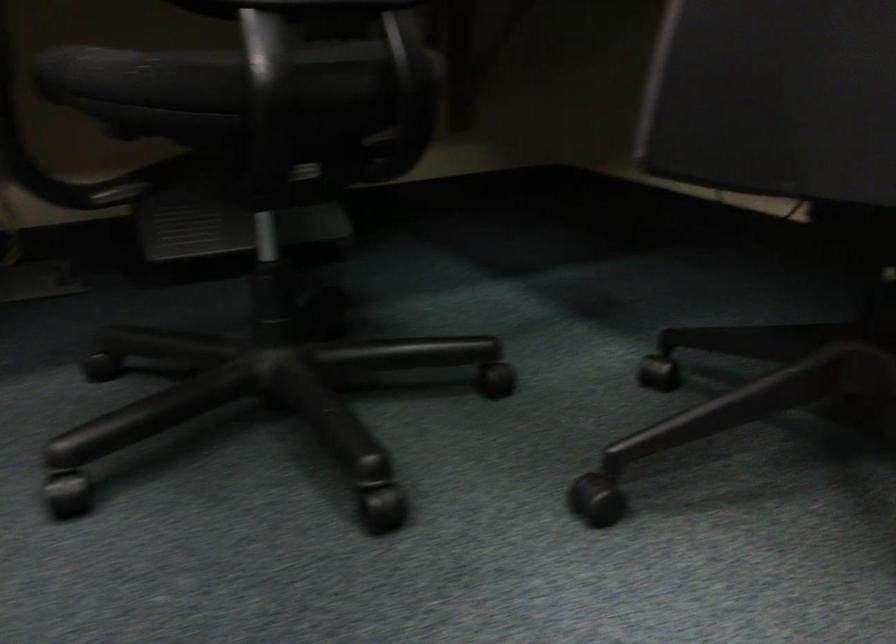
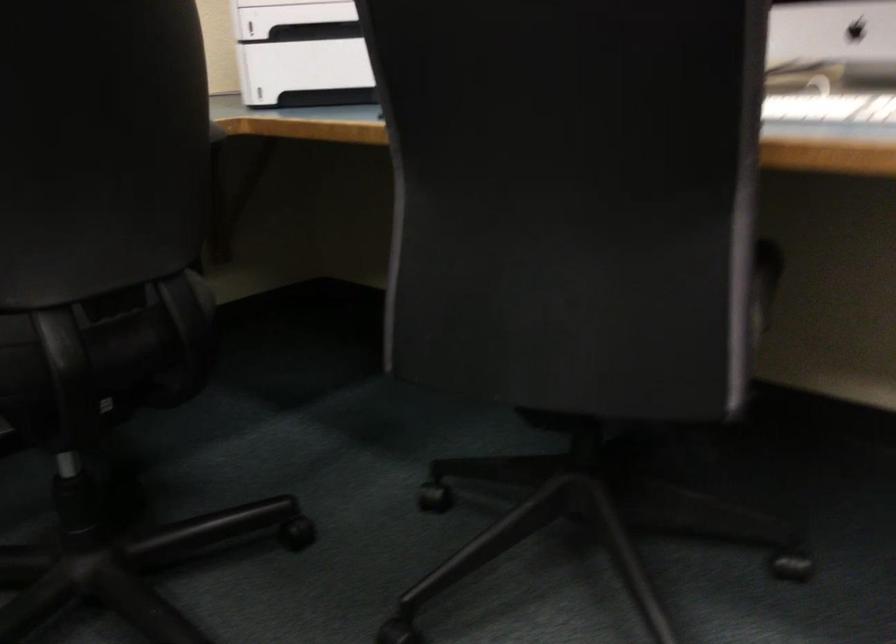
Question: Which direction would the cameraman need to move to produce the second image? Reply with the corresponding letter.

Choices:
 (A) Left
 (B) Right
 (C) Forward
 (D) Backward

Answer: (D)